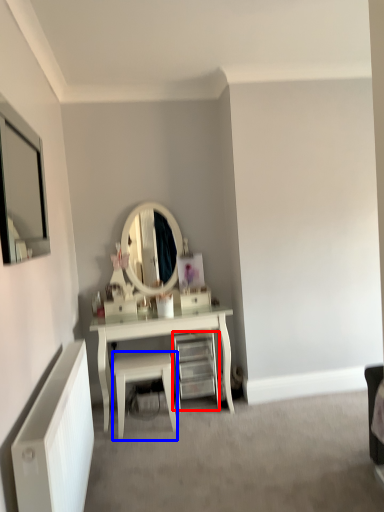
Question: Which object appears closest to the camera in this image, shelf (highlighted by a red box) or stool (highlighted by a blue box)?

Choices:
 (A) shelf
 (B) stool

Answer: (B)